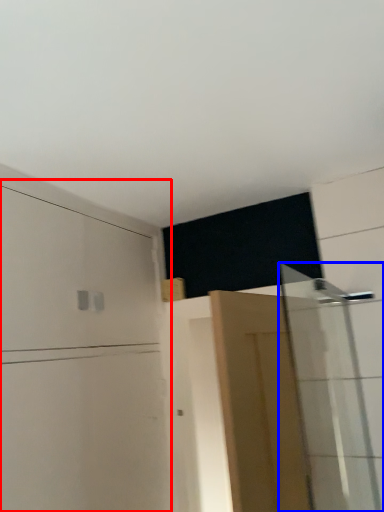
Question: Which point is further to the camera, dresser (highlighted by a red box) or shower door (highlighted by a blue box)?

Choices:
 (A) dresser
 (B) shower door

Answer: (B)